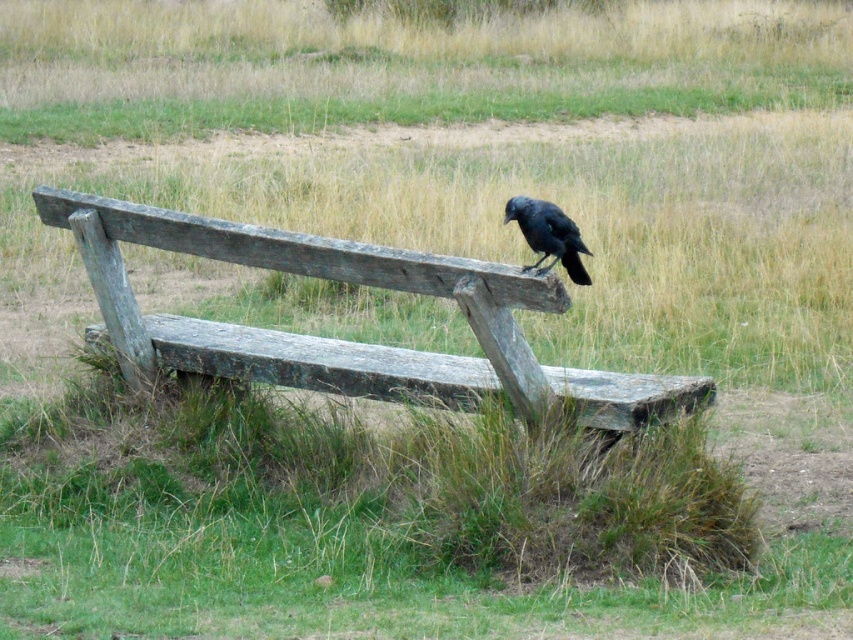
Is weathered wood bench at center taller than shiny black raven at upper center?

Correct, weathered wood bench at center is much taller as shiny black raven at upper center.

Who is more forward, (260, 337) or (578, 243)?

Point (578, 243)

Locate an element on the screen. This screenshot has height=640, width=853. weathered wood bench at center is located at coordinates (347, 340).